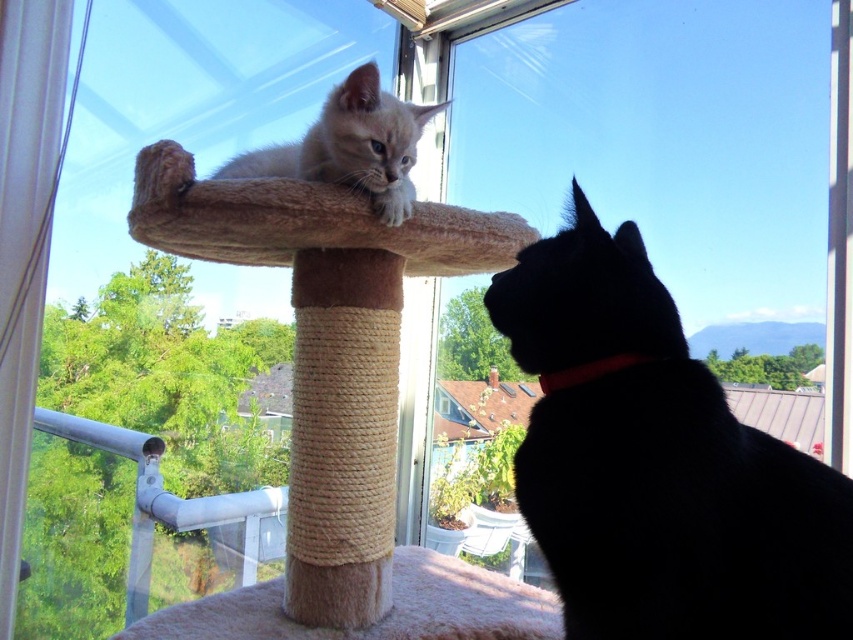
You are a cat owner who wants to place a toy between the black fur cat at upper right and the red fabric neckband at lower right. Where should you place the toy to ensure it is between them?

Place the toy to the left of the black fur cat at upper right or to the right of the red fabric neckband at lower right since the black fur cat at upper right is to the right of the red fabric neckband at lower right.

You are taking a photo of the two cats on the cat tree. You notice two points marked on the image at coordinates point [392,614] and point [582,364]. Which point is closer to your camera?

Point [392,614] is further to the camera than point [582,364], so the closer point to the camera is point [582,364].

You are a cat owner who wants to ensure your cats have enough space on the cat tree. You notice the red fabric neckband at lower right and the beige plush cat bed at center. Which object is closer to the front of the cat tree?

The beige plush cat bed at center is closer to the front of the cat tree because the red fabric neckband at lower right is behind it.